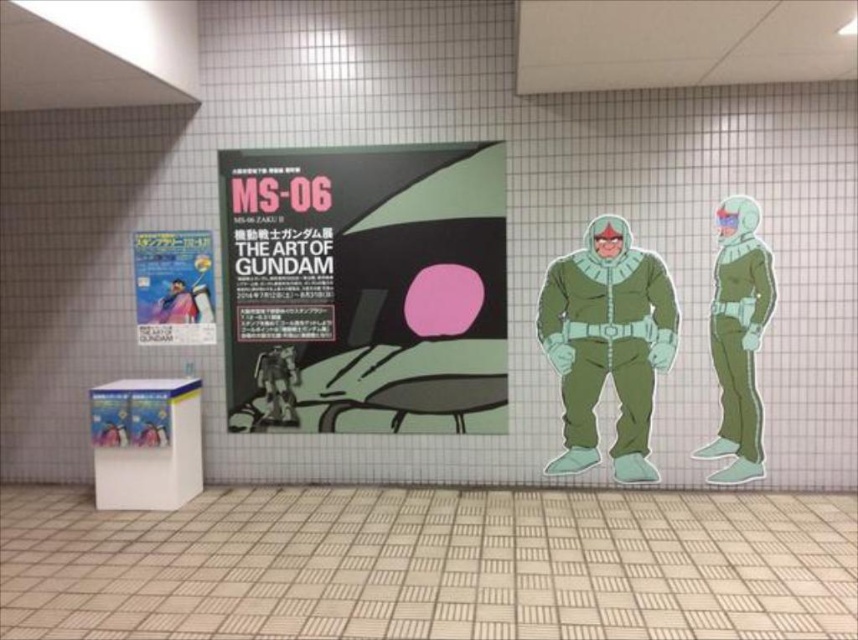
Question: Considering the real-world distances, which object is closest to the matte black poster at center?

Choices:
 (A) green matte suit at center
 (B) green matte astronaut suit at right
 (C) blue fabric scarf at center

Answer: (C)

Question: Which of the following is the closest to the observer?

Choices:
 (A) blue fabric scarf at center
 (B) matte black poster at center
 (C) metallic silver robot at center
 (D) green matte astronaut suit at right

Answer: (D)

Question: Can you confirm if green matte astronaut suit at right is bigger than matte paper poster at left?

Choices:
 (A) no
 (B) yes

Answer: (B)

Question: In this image, where is green matte suit at center located relative to green matte astronaut suit at right?

Choices:
 (A) left
 (B) right

Answer: (A)

Question: Among these objects, which one is farthest from the camera?

Choices:
 (A) matte black poster at center
 (B) blue fabric scarf at center
 (C) green matte astronaut suit at right
 (D) matte paper poster at left

Answer: (B)

Question: Does matte paper poster at left lie in front of blue fabric scarf at center?

Choices:
 (A) no
 (B) yes

Answer: (B)